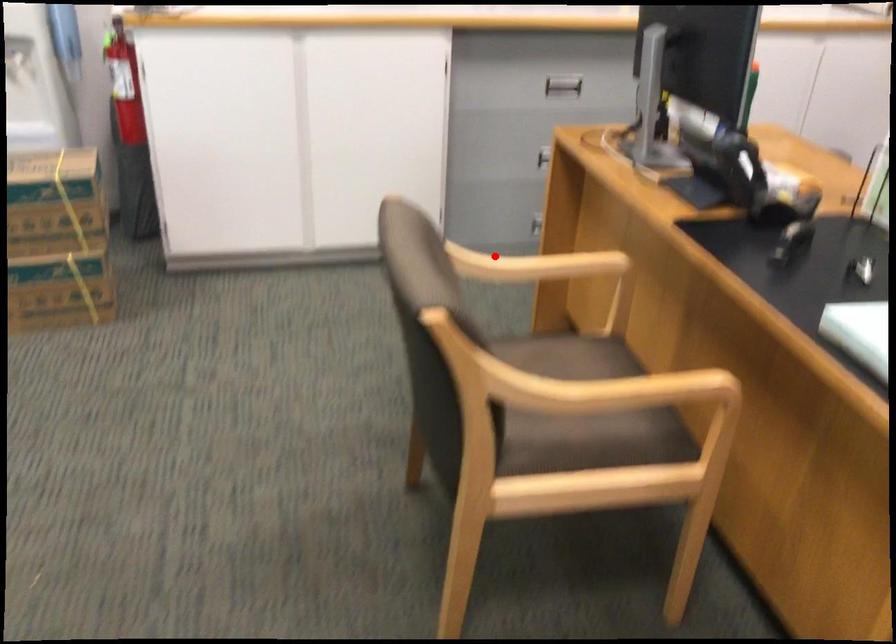
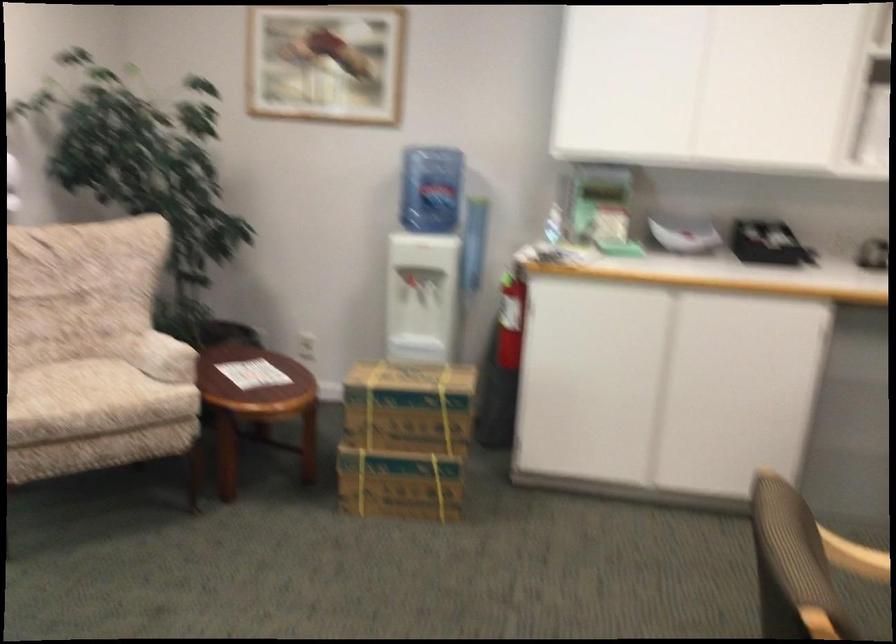
In the second image, find the point that corresponds to the highlighted location in the first image.

(857, 529)